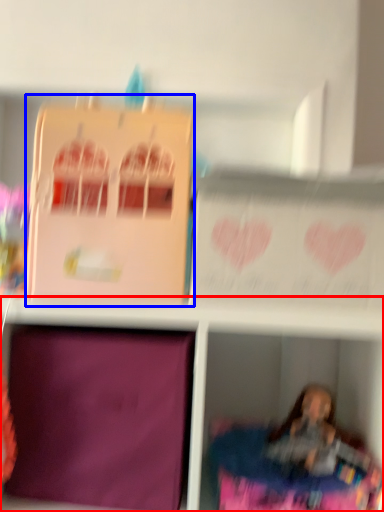
Question: Which point is further to the camera, shelf (highlighted by a red box) or cardboard box (highlighted by a blue box)?

Choices:
 (A) shelf
 (B) cardboard box

Answer: (B)